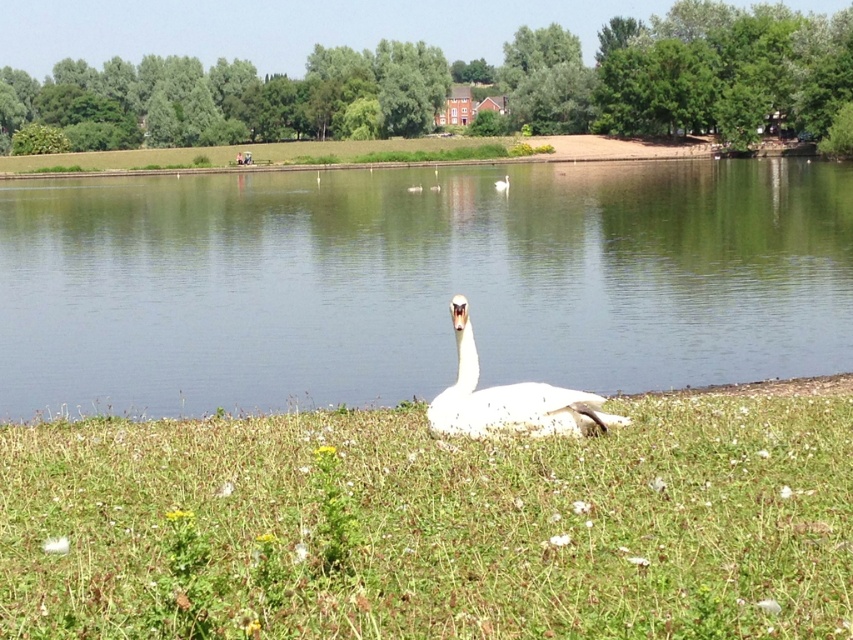
Does clear water at center appear under white matte goose at center?

Indeed, clear water at center is positioned under white matte goose at center.

Who is taller, clear water at center or white matte goose at center?

With more height is clear water at center.

This screenshot has width=853, height=640. What do you see at coordinates (418, 282) in the screenshot?
I see `clear water at center` at bounding box center [418, 282].

Where is `clear water at center`? This screenshot has height=640, width=853. clear water at center is located at coordinates (418, 282).

Which is more to the left, white glossy swan at center or white matte goose at center?

white glossy swan at center is more to the left.

Is point (614, 417) farther from camera compared to point (503, 188)?

No.

Identify the location of white glossy swan at center. This screenshot has width=853, height=640. [x=508, y=397].

Which is behind, point (194, 554) or point (47, 300)?

The point (47, 300) is behind.

Who is positioned more to the left, white soft grass at center or clear water at center?

clear water at center

Is point (318, 628) behind point (680, 200)?

No, (318, 628) is closer to viewer.

Find the location of a particular element. white soft grass at center is located at coordinates (436, 524).